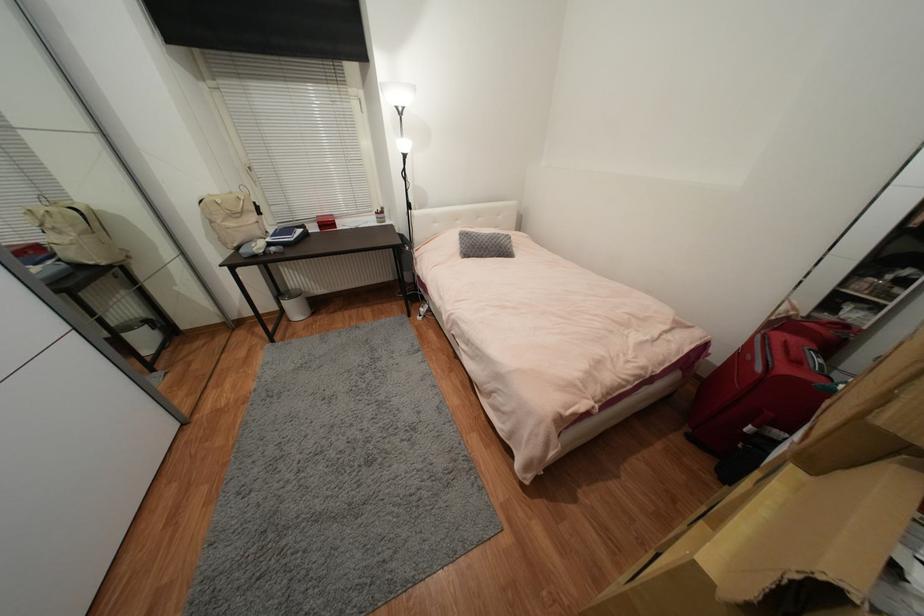
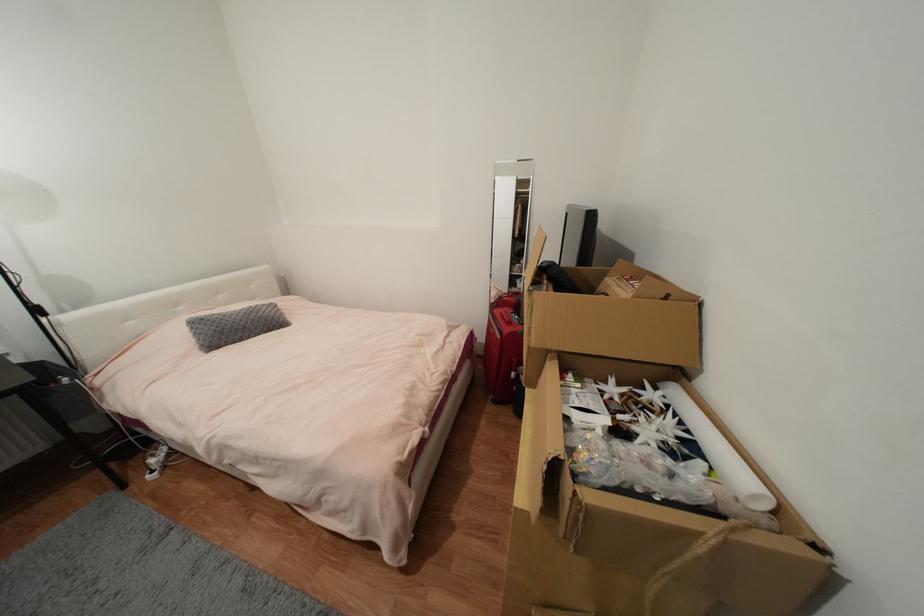
The point at (490, 241) is marked in the first image. Where is the corresponding point in the second image?

(244, 320)